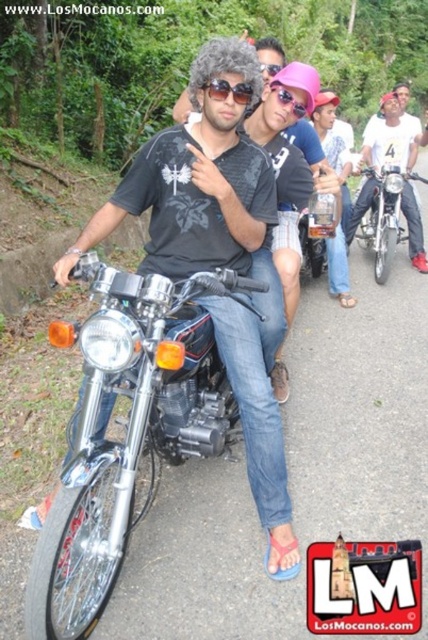
You are a photographer standing at the edge of the road. You want to take a photo of the matte black shirt at center and the shiny chrome motorcycle at center in the same frame. Given that your camera has a maximum focus range of 3 meters, will both subjects be in focus?

The matte black shirt at center and shiny chrome motorcycle at center are 3.34 meters apart. Since the distance between them exceeds the camera focus range of 3 meters, both subjects cannot be in focus simultaneously.

You are standing at a point 5 feet away from the motorcycle. Is the point at coordinate point (92, 580) closer to you than the motorcycle?

The distance of point (92, 580) from viewer is 6.23 feet, so the point is farther away than the motorcycle which is 5 feet away from you.